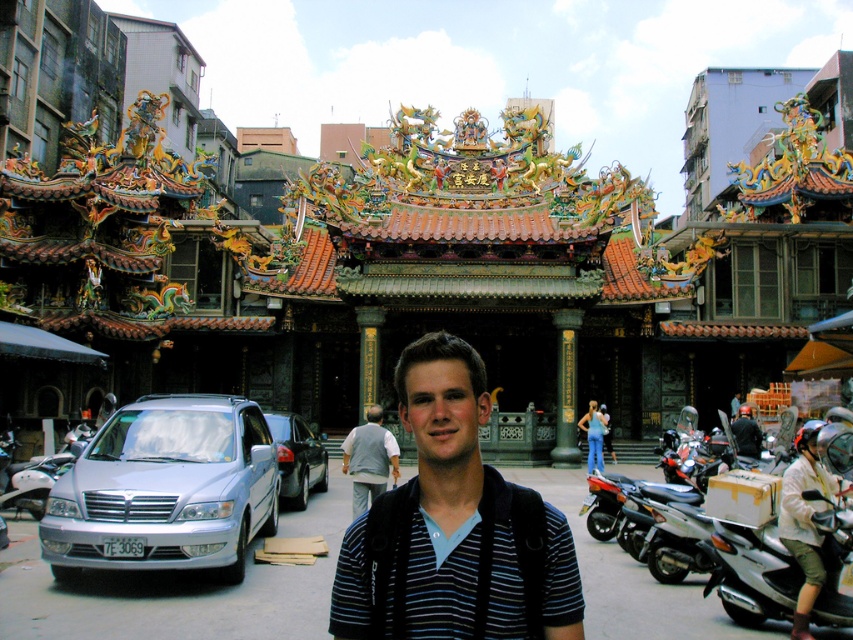
You are a photographer trying to capture the temple and its surroundings. You notice the metallic silver motorcycle at lower right and the dark blue shirt at center in your frame. Since you want to ensure both elements are clearly visible, which object should you focus on first to account for their size in the frame?

The metallic silver motorcycle at lower right is taller than the dark blue shirt at center, so you should focus on the metallic silver motorcycle at lower right first to ensure its details are sharp, as it occupies more vertical space in the frame.